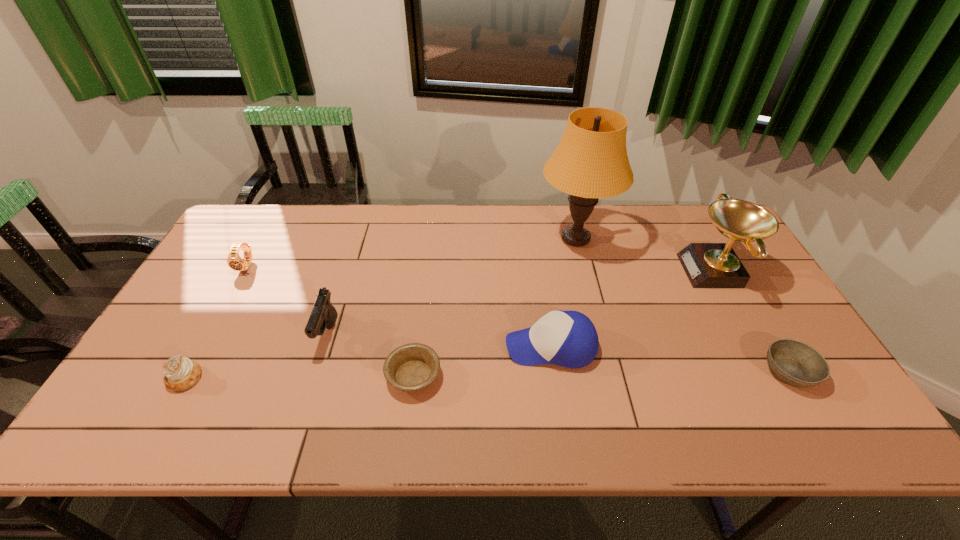
Where is `vacant region at the left edge`? The width and height of the screenshot is (960, 540). vacant region at the left edge is located at coordinates (196, 333).

At what (x,y) coordinates should I click in order to perform the action: click on vacant space at the right edge. Please return your answer as a coordinate pair (x, y). This screenshot has width=960, height=540. Looking at the image, I should click on (777, 313).

Locate an element on the screen. The image size is (960, 540). free area in between the fourth tallest object and the fourth shortest object is located at coordinates (398, 306).

The height and width of the screenshot is (540, 960). What are the coordinates of `blank region between the pistol and the tallest object` in the screenshot? It's located at (452, 286).

Identify the location of unoccupied area between the baseball cap and the sixth tallest object. The width and height of the screenshot is (960, 540). (368, 362).

The height and width of the screenshot is (540, 960). I want to click on free spot between the third object from left to right and the award, so pos(521,302).

Where is `vacant region between the award and the right bowl`? Image resolution: width=960 pixels, height=540 pixels. vacant region between the award and the right bowl is located at coordinates (753, 321).

Identify the location of vacant point located between the right bowl and the seventh shortest object. The width and height of the screenshot is (960, 540). (753, 321).

The width and height of the screenshot is (960, 540). In order to click on free space between the fifth shortest object and the watch in this screenshot , I will do `click(398, 306)`.

The image size is (960, 540). What are the coordinates of `free space between the third shortest object and the fourth tallest object` in the screenshot? It's located at (368, 362).